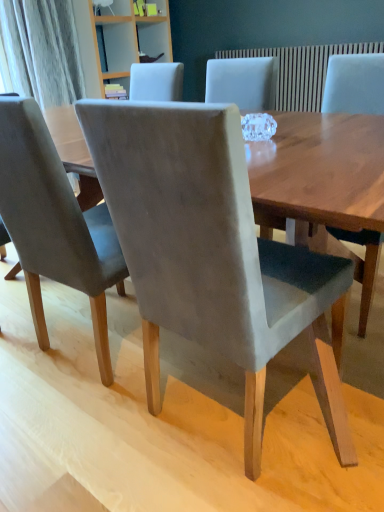
Identify the location of free space that is in between suede gray chair at center, arranged as the 2th chair when viewed from the right, and suede gray chair at center, acting as the third chair starting from the right. (159, 382).